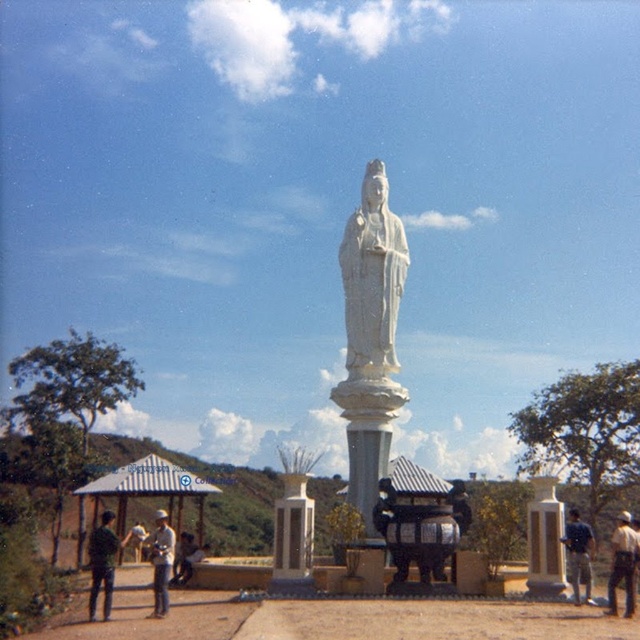
Question: Does white marble pedestal at center appear on the left side of white marble column at center?

Choices:
 (A) yes
 (B) no

Answer: (A)

Question: Which of the following is the closest to the observer?

Choices:
 (A) (381, 440)
 (B) (163, 513)

Answer: (B)

Question: Is white marble pedestal at center thinner than blue fabric shirt at lower right?

Choices:
 (A) yes
 (B) no

Answer: (A)

Question: Which object is the closest to the green matte shirt at lower left?

Choices:
 (A) light blue jeans at center
 (B) white marble column at center
 (C) white marble pedestal at center
 (D) white marble pillar at center

Answer: (A)

Question: Is white marble pedestal at center wider than white stone statue at center?

Choices:
 (A) yes
 (B) no

Answer: (B)

Question: Which object is closer to the camera taking this photo?

Choices:
 (A) green matte shirt at lower left
 (B) white stone statue at center

Answer: (A)